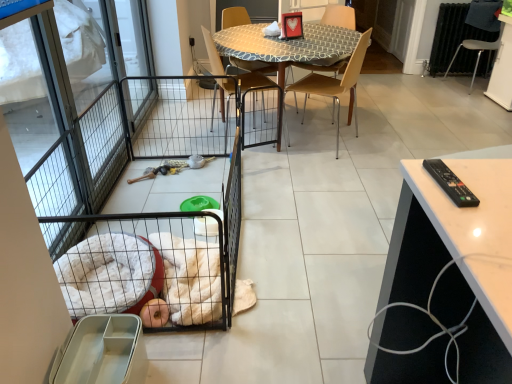
This screenshot has width=512, height=384. What are the coordinates of `vacant space to the right of wooden chair at center, the second chair viewed from the right` in the screenshot? It's located at (375, 105).